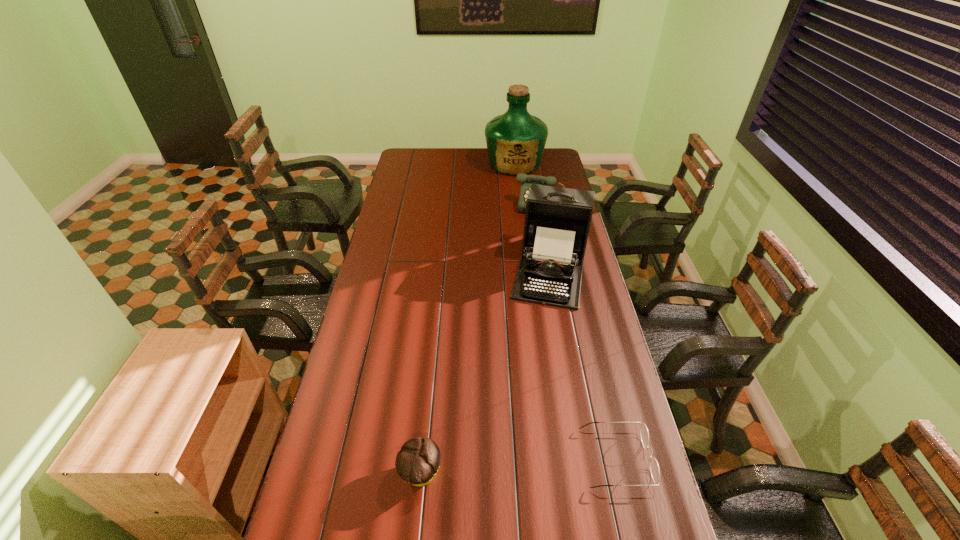
Locate an element on the screen. vacant area situated 0.330m inside the open case of the third nearest object is located at coordinates click(534, 382).

Where is `vacant space located inside the open case of the third nearest object`? The width and height of the screenshot is (960, 540). vacant space located inside the open case of the third nearest object is located at coordinates (540, 341).

Where is `free space located 0.060m inside the open case of the third nearest object`? free space located 0.060m inside the open case of the third nearest object is located at coordinates coord(544,321).

This screenshot has width=960, height=540. I want to click on free space located 0.240m on the dial of the third tallest object, so click(x=535, y=247).

Identify the location of vacant space located on the dial of the third tallest object. Image resolution: width=960 pixels, height=540 pixels. (538, 231).

I want to click on free space located on the dial of the third tallest object, so click(536, 242).

Where is `free point located 0.090m on the label side of the liquor`? The image size is (960, 540). free point located 0.090m on the label side of the liquor is located at coordinates (513, 188).

Where is `free region located 0.150m on the label side of the liquor`? free region located 0.150m on the label side of the liquor is located at coordinates (513, 194).

Where is `free space located 0.290m on the label side of the liquor`? free space located 0.290m on the label side of the liquor is located at coordinates (512, 210).

This screenshot has height=540, width=960. Identify the location of object that is at the far edge. (515, 140).